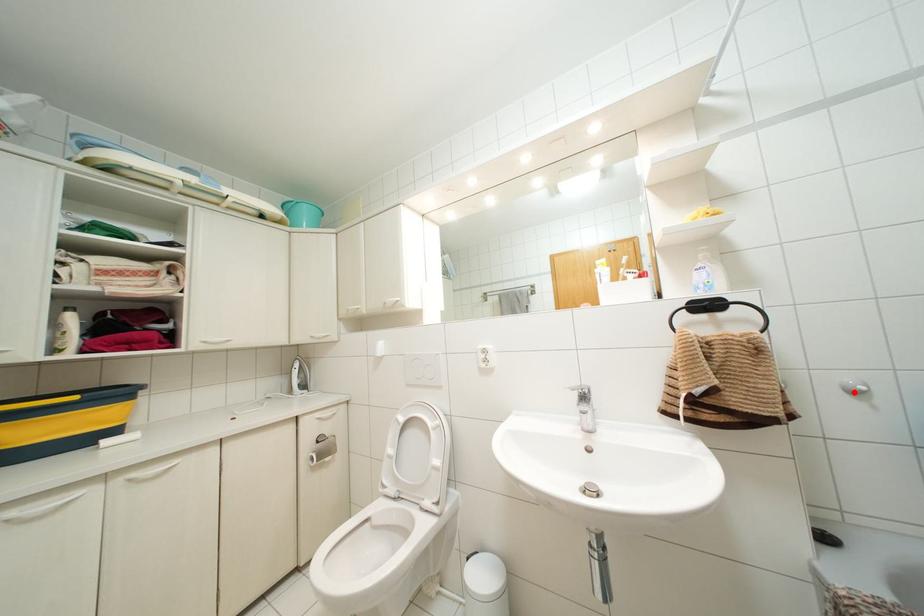
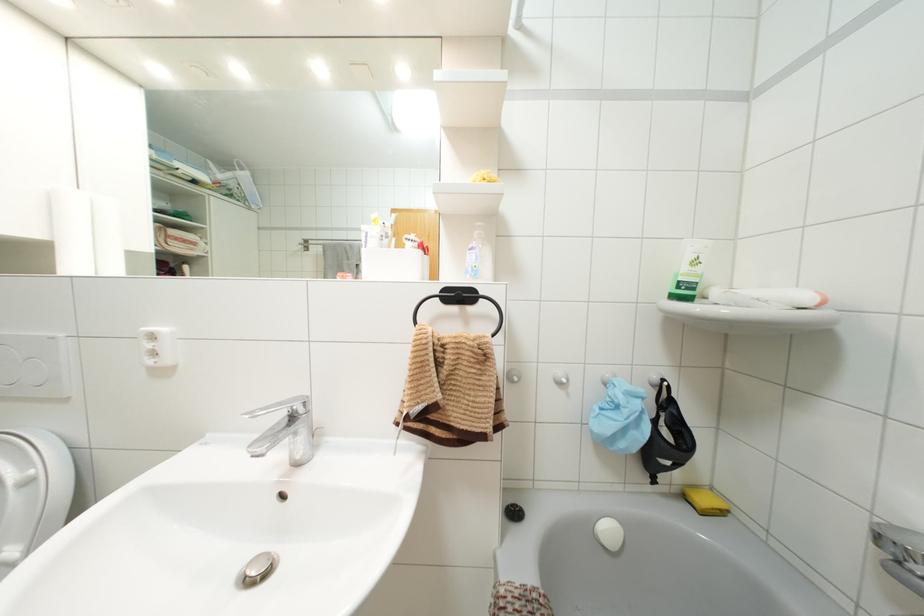
Question: A red point is marked in image1. In image2, is the corresponding 3D point closer to the camera or farther? Reply with the corresponding letter.

Choices:
 (A) The corresponding 3D point is closer.
 (B) The corresponding 3D point is farther.

Answer: (B)